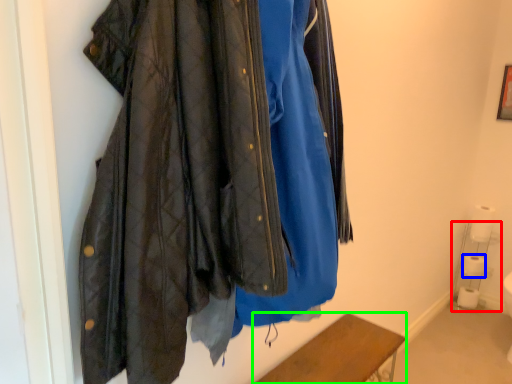
Question: Considering the real-world distances, which object is farthest from shelf (highlighted by a red box)? toilet paper (highlighted by a blue box) or furniture (highlighted by a green box)?

Choices:
 (A) toilet paper
 (B) furniture

Answer: (B)